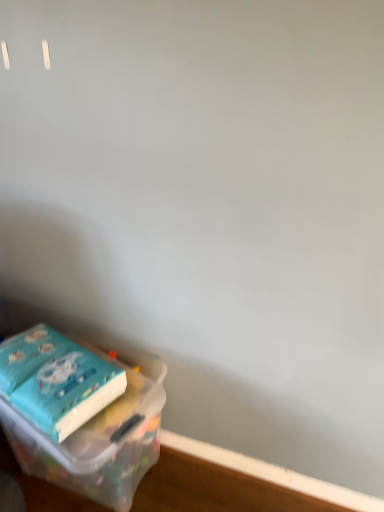
Question: Does wooden at lower left contain teal matte paper at lower left?

Choices:
 (A) yes
 (B) no

Answer: (B)

Question: Is wooden at lower left bigger than teal matte paper at lower left?

Choices:
 (A) no
 (B) yes

Answer: (A)

Question: Considering the relative positions of wooden at lower left and teal matte paper at lower left in the image provided, is wooden at lower left behind teal matte paper at lower left?

Choices:
 (A) no
 (B) yes

Answer: (B)

Question: From a real-world perspective, is wooden at lower left physically below teal matte paper at lower left?

Choices:
 (A) yes
 (B) no

Answer: (A)

Question: From the image's perspective, would you say wooden at lower left is shown under teal matte paper at lower left?

Choices:
 (A) no
 (B) yes

Answer: (B)

Question: Would you say wooden at lower left is to the left or to the right of translucent plastic container at lower left in the picture?

Choices:
 (A) right
 (B) left

Answer: (A)

Question: From a real-world perspective, is wooden at lower left physically located above or below translucent plastic container at lower left?

Choices:
 (A) below
 (B) above

Answer: (A)

Question: In the image, is wooden at lower left positioned in front of or behind translucent plastic container at lower left?

Choices:
 (A) front
 (B) behind

Answer: (B)

Question: In terms of height, does wooden at lower left look taller or shorter compared to translucent plastic container at lower left?

Choices:
 (A) tall
 (B) short

Answer: (B)

Question: Is translucent plastic container at lower left wider or thinner than wooden at lower left?

Choices:
 (A) wide
 (B) thin

Answer: (A)

Question: In the image, is translucent plastic container at lower left positioned in front of or behind wooden at lower left?

Choices:
 (A) behind
 (B) front

Answer: (B)

Question: From a real-world perspective, is translucent plastic container at lower left positioned above or below wooden at lower left?

Choices:
 (A) below
 (B) above

Answer: (B)

Question: Is point (56, 415) closer or farther from the camera than point (253, 459)?

Choices:
 (A) closer
 (B) farther

Answer: (A)

Question: Is translucent plastic container at lower left situated inside teal matte paper at lower left or outside?

Choices:
 (A) outside
 (B) inside

Answer: (A)

Question: Does point (148, 378) appear closer or farther from the camera than point (59, 430)?

Choices:
 (A) farther
 (B) closer

Answer: (A)